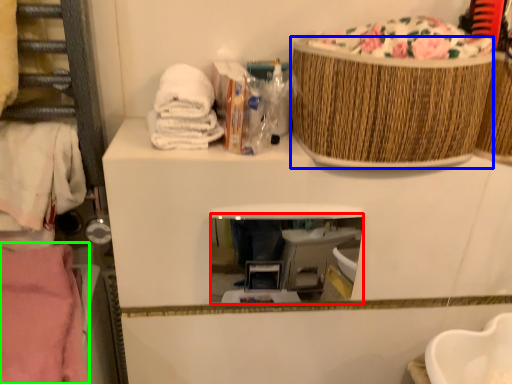
Question: Which is farther away from mirror (highlighted by a red box)? basket (highlighted by a blue box) or clothing (highlighted by a green box)?

Choices:
 (A) basket
 (B) clothing

Answer: (B)